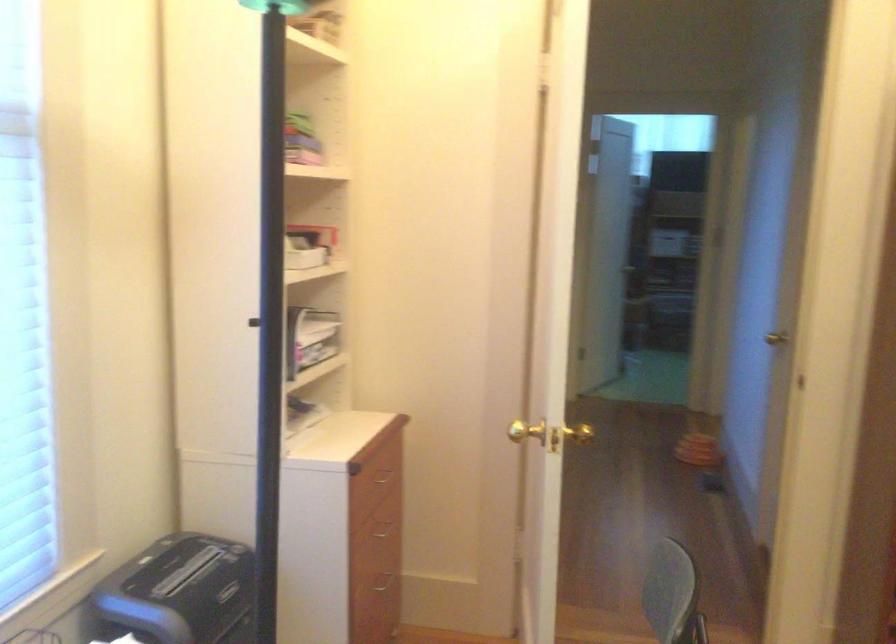
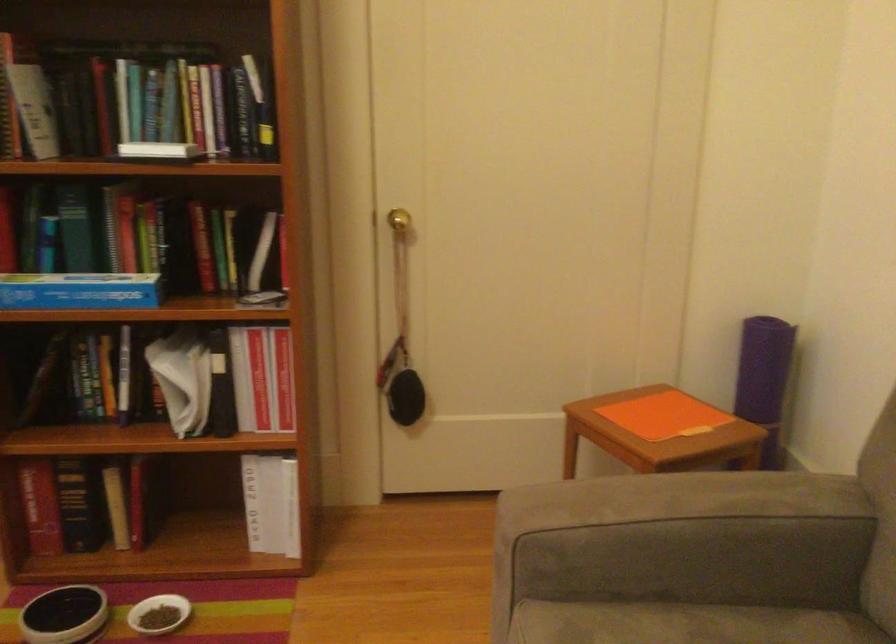
Question: In a continuous first-person perspective shot, in which direction is the camera moving?

Choices:
 (A) Left
 (B) Right
 (C) Forward
 (D) Backward

Answer: (B)